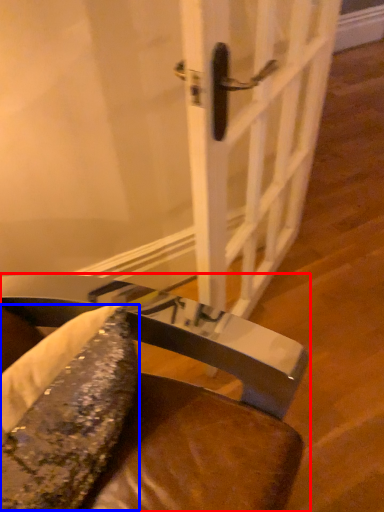
Question: Among these objects, which one is farthest to the camera, chair (highlighted by a red box) or food (highlighted by a blue box)?

Choices:
 (A) chair
 (B) food

Answer: (B)